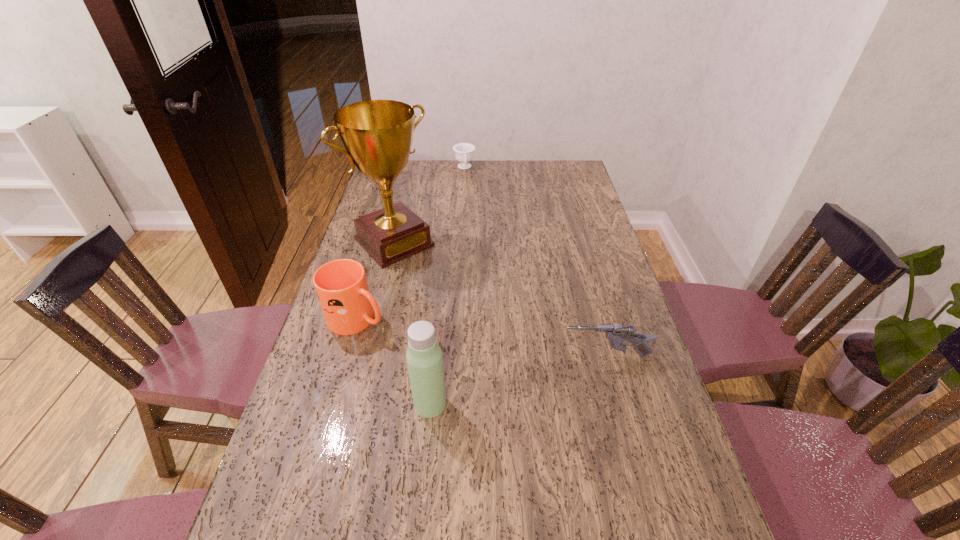
You are a GUI agent. You are given a task and a screenshot of the screen. Output one action in this format:
    pyautogui.click(x=<x>, y=<y>)
    Task: Click on the free spot at the right edge of the desktop
    
    Given the screenshot: What is the action you would take?
    pyautogui.click(x=622, y=401)

Where is `vacant space at the far left corner of the desktop`? This screenshot has width=960, height=540. vacant space at the far left corner of the desktop is located at coordinates (410, 178).

You are a GUI agent. You are given a task and a screenshot of the screen. Output one action in this format:
    pyautogui.click(x=<x>, y=<y>)
    Task: Click on the blank space at the near left corner
    The image size is (960, 540).
    Given the screenshot: What is the action you would take?
    pyautogui.click(x=268, y=517)

At what (x,y) coordinates should I click in order to perform the action: click on vacant region at the far right corner. Please return your answer as a coordinate pair (x, y). Image resolution: width=960 pixels, height=540 pixels. Looking at the image, I should click on (581, 184).

In the image, there is a desktop. What are the coordinates of `vacant space at the near right corner` in the screenshot? It's located at (686, 514).

Locate an element on the screen. free space between the second nearest object and the farthest object is located at coordinates (536, 262).

Find the location of a particular element. The image size is (960, 540). vacant point located between the fourth shortest object and the third shortest object is located at coordinates (394, 361).

Identify the location of free space between the second tallest object and the third tallest object. Image resolution: width=960 pixels, height=540 pixels. (394, 361).

Identify the location of vacant area that lies between the fourth farthest object and the fourth nearest object. This screenshot has height=540, width=960. tap(500, 299).

This screenshot has width=960, height=540. I want to click on vacant region between the rightmost object and the mug, so click(482, 338).